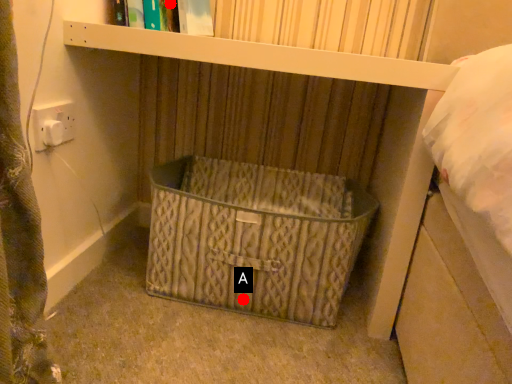
Question: Two points are circled on the image, labeled by A and B beside each circle. Which of the following is the farthest from the observer?

Choices:
 (A) A is further
 (B) B is further

Answer: (B)